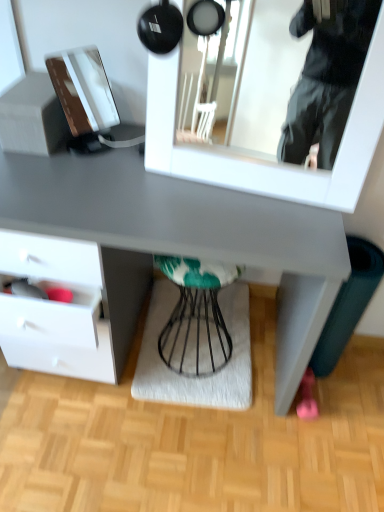
Find the location of a particular element. unoccupied space behind teal fabric stool at center is located at coordinates (205, 300).